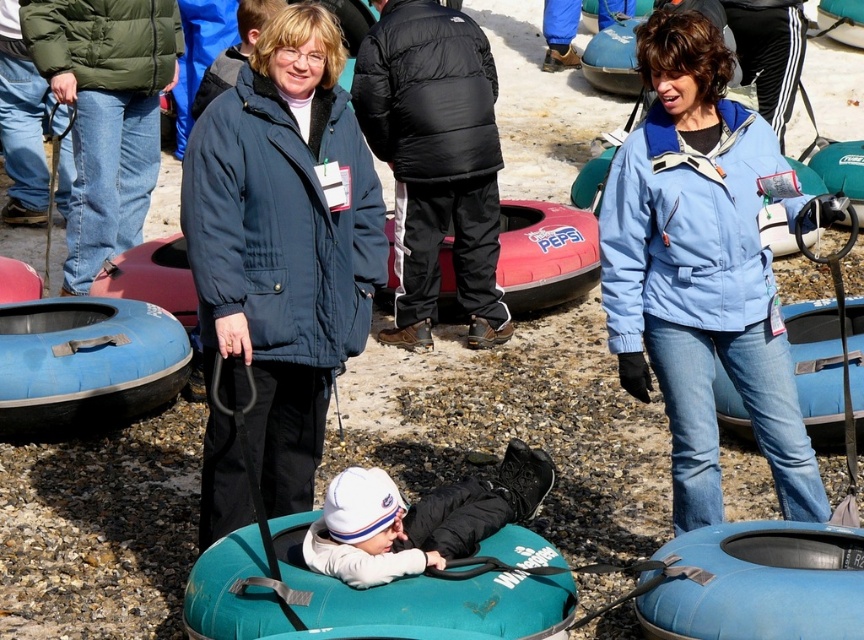
You are a visitor at this winter event and want to find the black rubber handle at center. Where should you look relative to the blue rubber boat at lower right?

The black rubber handle at center is below the blue rubber boat at lower right.

You are a visitor at the event and want to know which object is shorter between the blue rubber tube at lower right and the white fleece jacket at center. Can you tell me?

The blue rubber tube at lower right has a lesser height compared to the white fleece jacket at center, so the blue rubber tube at lower right is shorter.

You are planning to place the blue rubber boat at lower right inside the black rubber handle at center. Is this possible based on their sizes?

The blue rubber boat at lower right is not as tall as the black rubber handle at center, so it can fit inside.